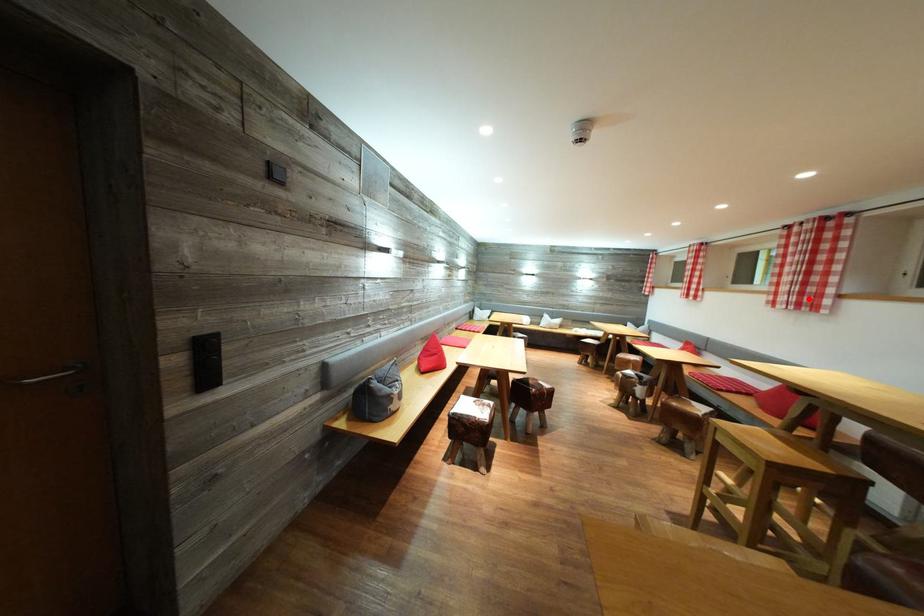
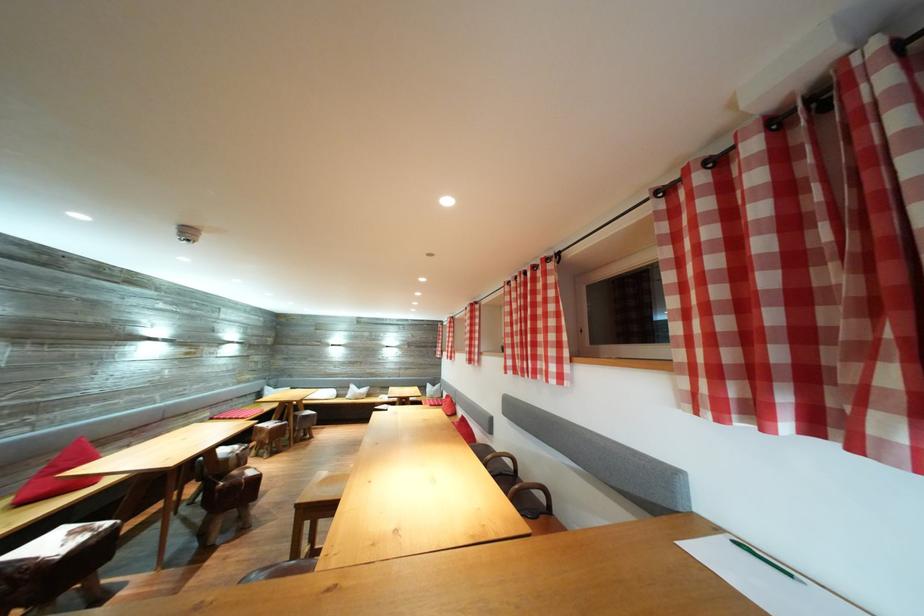
Find the pixel in the second image that matches the highlighted location in the first image.

(477, 359)